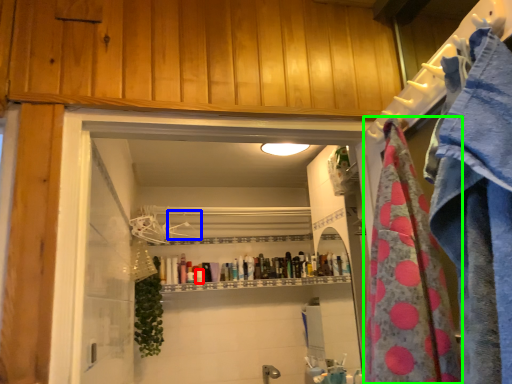
Question: Estimate the real-world distances between objects in this image. Which object is closer to toiletry (highlighted by a red box), hanger (highlighted by a blue box) or beach towel (highlighted by a green box)?

Choices:
 (A) hanger
 (B) beach towel

Answer: (A)